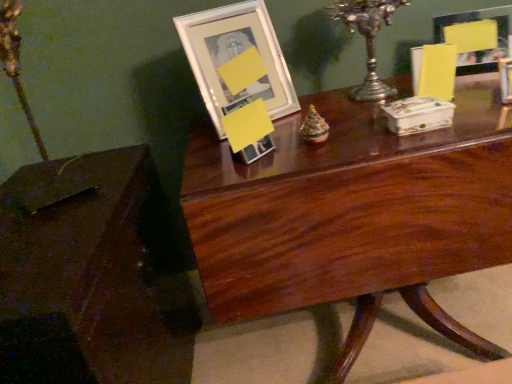
This screenshot has width=512, height=384. In order to click on spots to the right of white glossy picture frame at upper center, placed as the 2th picture frame when sorted from right to left in this screenshot , I will do `click(321, 114)`.